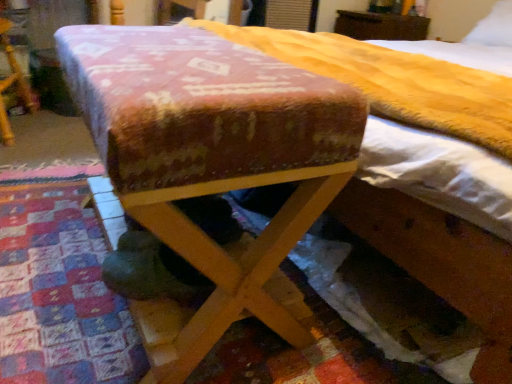
The image size is (512, 384). Find the location of `free space above velvet-like fabric ottoman at center, the second furniture when ordered from left to right (from a real-world perspective)`. free space above velvet-like fabric ottoman at center, the second furniture when ordered from left to right (from a real-world perspective) is located at coordinates (183, 54).